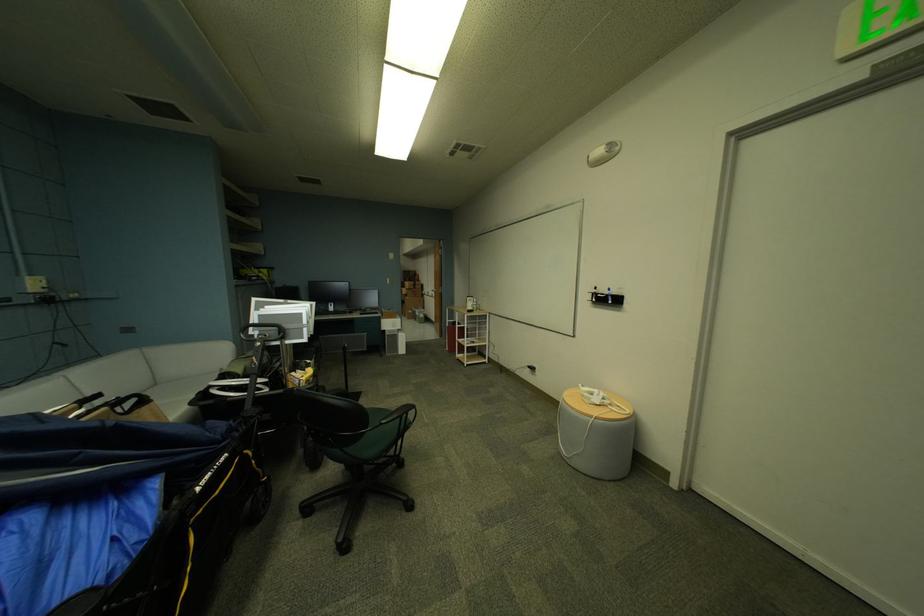
Where would you resting arm the black chair armrest? Please return your answer as a coordinate pair (x, y).

(399, 413)